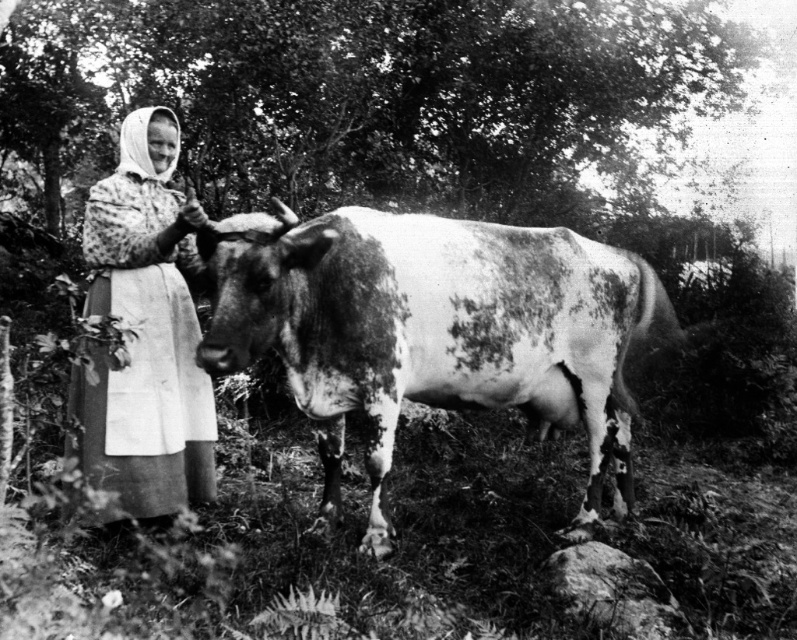
You are a photographer aiming to capture a closeup shot of the speckled fur at center. Your camera has a minimum focusing distance of 2.5 meters. Will you be able to take the photo without moving closer?

The distance between the speckled fur at center and the camera is 3.04 meters, which is greater than the camera minimum focusing distance of 2.5 meters. Therefore, you can take the closeup shot without moving closer.